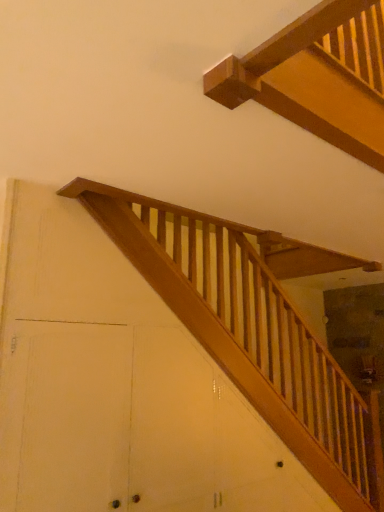
You are a GUI agent. You are given a task and a screenshot of the screen. Output one action in this format:
    pyautogui.click(x=<x>, y=<y>)
    Task: Click on the white matte door at lower left
    The height and width of the screenshot is (512, 384).
    Given the screenshot: What is the action you would take?
    pyautogui.click(x=76, y=419)

The height and width of the screenshot is (512, 384). Describe the element at coordinates (76, 419) in the screenshot. I see `white matte door at lower left` at that location.

Where is `white matte door at lower left`? This screenshot has height=512, width=384. white matte door at lower left is located at coordinates (76, 419).